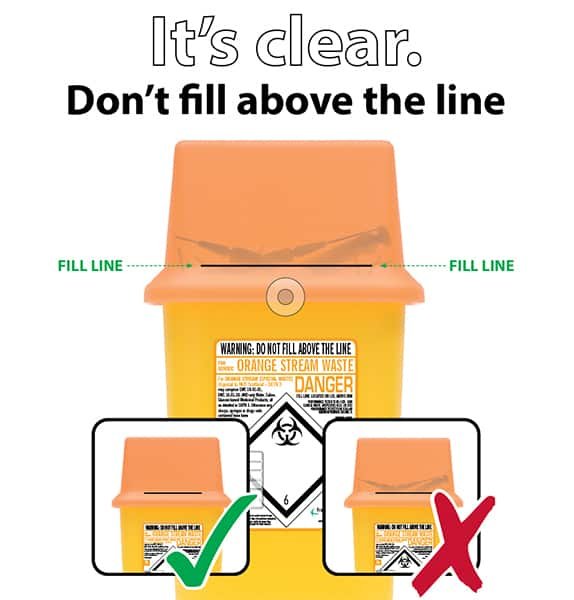
Identify the location of image of orange and yellow trashcan. (394, 492), (193, 483), (246, 316).